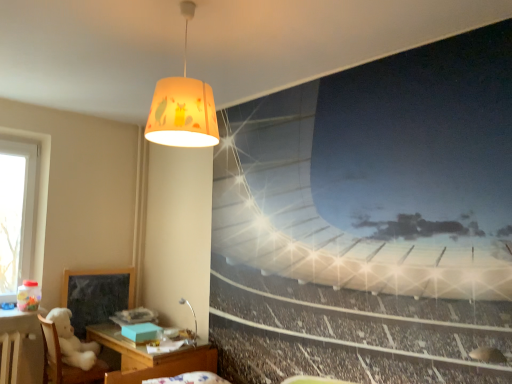
Question: Would you say metallic silver desk lamp at lower center, which is the 1th lamp in back-to-front order, is inside or outside dark gray matte bulletin board at lower left?

Choices:
 (A) inside
 (B) outside

Answer: (B)

Question: Is point (181, 299) closer or farther from the camera than point (83, 311)?

Choices:
 (A) closer
 (B) farther

Answer: (A)

Question: Considering the real-world distances, which object is farthest from the dark gray matte bulletin board at lower left?

Choices:
 (A) metallic silver desk lamp at lower center, the 2th lamp in the front-to-back sequence
 (B) white plush bear at lower left
 (C) wooden table at lower left
 (D) matte yellow fabric lampshade at upper center, the second lamp positioned from the back

Answer: (D)

Question: Which object is the closest to the wooden table at lower left?

Choices:
 (A) dark gray matte bulletin board at lower left
 (B) metallic silver desk lamp at lower center, the 2th lamp in the front-to-back sequence
 (C) matte yellow fabric lampshade at upper center, which is counted as the first lamp, starting from the front
 (D) white plush bear at lower left

Answer: (D)